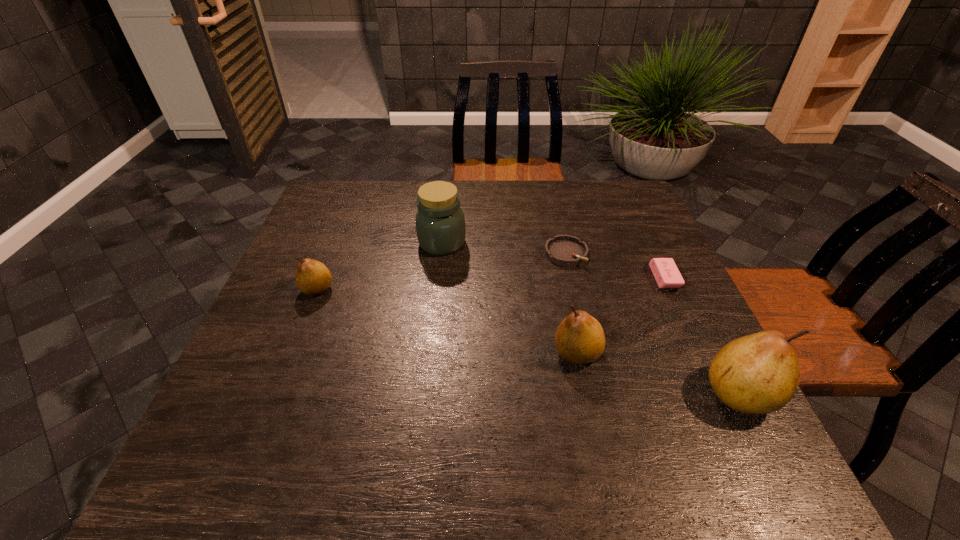
The image size is (960, 540). In order to click on vacant region located 0.080m on the left of the rightmost pear in this screenshot , I will do `click(662, 393)`.

Where is `free space located 0.060m on the front of the eraser`? free space located 0.060m on the front of the eraser is located at coordinates (680, 311).

Identify the location of vacant position located on the left of the ashtray. (453, 254).

Locate an element on the screen. vacant space situated 0.310m on the front of the second object from left to right is located at coordinates (431, 349).

Find the location of a particular element. The height and width of the screenshot is (540, 960). object that is at the near edge is located at coordinates (755, 374).

Identify the location of object at the left edge. The image size is (960, 540). (313, 278).

Locate an element on the screen. This screenshot has height=540, width=960. pear that is at the right edge is located at coordinates (755, 374).

Where is `eraser at the right edge`? The image size is (960, 540). eraser at the right edge is located at coordinates (665, 271).

Locate an element on the screen. object that is at the near right corner is located at coordinates (755, 374).

Where is `vacant region at the far edge`? The image size is (960, 540). vacant region at the far edge is located at coordinates tap(494, 211).